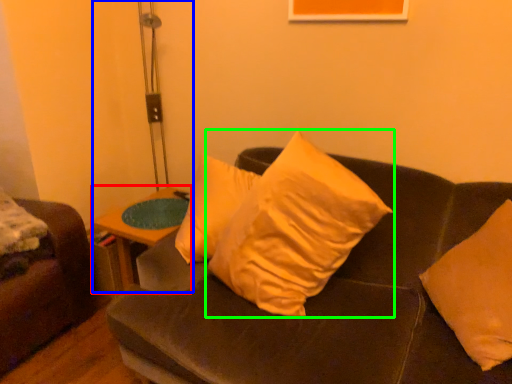
Question: Which object is positioned farthest from table (highlighted by a red box)? Select from table lamp (highlighted by a blue box) and pillow (highlighted by a green box).

Choices:
 (A) table lamp
 (B) pillow

Answer: (A)